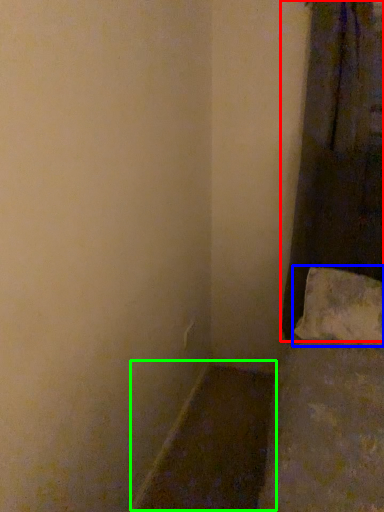
Question: Which object is the farthest from curtain (highlighted by a red box)? Choose among these: pillow (highlighted by a blue box) or window sill (highlighted by a green box).

Choices:
 (A) pillow
 (B) window sill

Answer: (B)